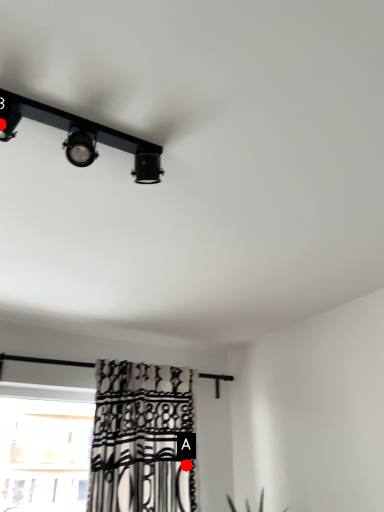
Question: Two points are circled on the image, labeled by A and B beside each circle. Which point is closer to the camera taking this photo?

Choices:
 (A) A is closer
 (B) B is closer

Answer: (B)